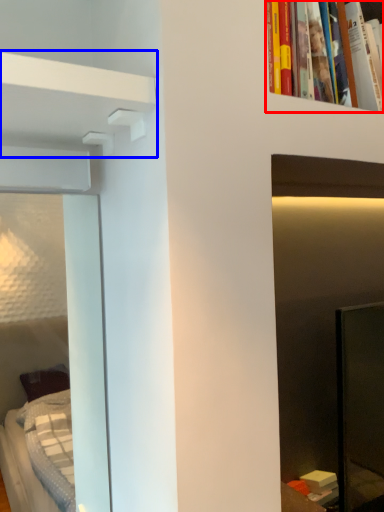
Question: Which object appears farthest to the camera in this image, book (highlighted by a red box) or shelf (highlighted by a blue box)?

Choices:
 (A) book
 (B) shelf

Answer: (A)